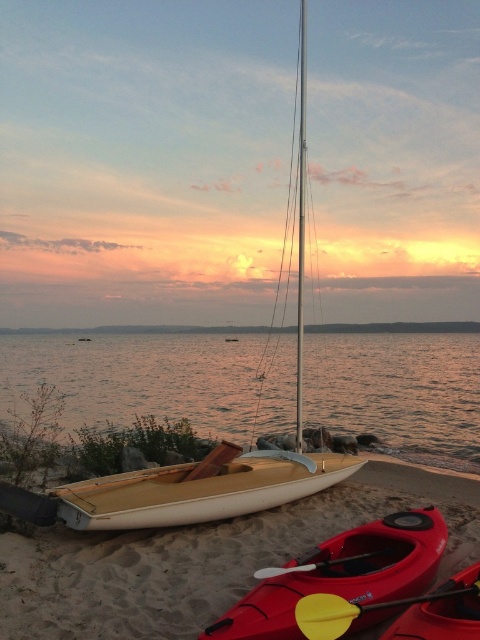
Is wooden sailboat at center below matte red kayak at lower center?

No.

Is point (76, 506) positioned in front of point (354, 573)?

No, it is behind (354, 573).

You are a GUI agent. You are given a task and a screenshot of the screen. Output one action in this format:
    pyautogui.click(x=<x>, y=<y>)
    Task: Click on the wooden sailboat at center
    
    Given the screenshot: What is the action you would take?
    click(216, 445)

Is beige sand at center wider than matte red kayak at lower center?

In fact, beige sand at center might be narrower than matte red kayak at lower center.

Is beige sand at center closer to the viewer compared to matte red kayak at lower center?

No.

Which is in front, point (269, 563) or point (369, 616)?

Point (369, 616) is in front.

You are a GUI agent. You are given a task and a screenshot of the screen. Output one action in this format:
    pyautogui.click(x=<x>, y=<y>)
    Task: Click on the beige sand at center
    Image resolution: width=480 pixels, height=640 pixels.
    Given the screenshot: What is the action you would take?
    pyautogui.click(x=204, y=557)

Who is more forward, (153, 483) or (452, 636)?

Positioned in front is point (452, 636).

Where is `wooden canoe at center`? wooden canoe at center is located at coordinates (200, 488).